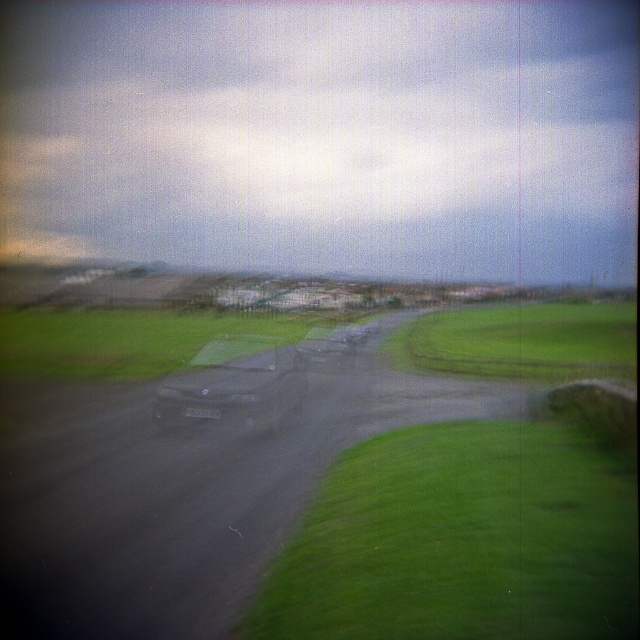
Looking at this image, does shiny metallic car at center appear on the right side of shiny silver car at center?

Incorrect, shiny metallic car at center is not on the right side of shiny silver car at center.

Describe the element at coordinates (234, 385) in the screenshot. I see `shiny metallic car at center` at that location.

Find the location of `shiny metallic car at center`. shiny metallic car at center is located at coordinates (234, 385).

This screenshot has height=640, width=640. Identify the location of shiny metallic car at center. (234, 385).

Is green grassy at lower right thinner than shiny silver car at center?

Incorrect, green grassy at lower right's width is not less than shiny silver car at center's.

Measure the distance between point (577, 428) and camera.

They are 14.65 meters apart.

This screenshot has width=640, height=640. What do you see at coordinates (461, 540) in the screenshot?
I see `green grassy at lower right` at bounding box center [461, 540].

Where is `green grassy at lower right`? The height and width of the screenshot is (640, 640). green grassy at lower right is located at coordinates (461, 540).

Is green grassy at lower right closer to camera compared to shiny metallic car at center?

Yes, green grassy at lower right is in front of shiny metallic car at center.

Can you confirm if green grassy at lower right is positioned above shiny metallic car at center?

Actually, green grassy at lower right is below shiny metallic car at center.

Between point (410, 620) and point (170, 380), which one is positioned behind?

Point (170, 380)

Image resolution: width=640 pixels, height=640 pixels. In order to click on green grassy at lower right in this screenshot , I will do `click(461, 540)`.